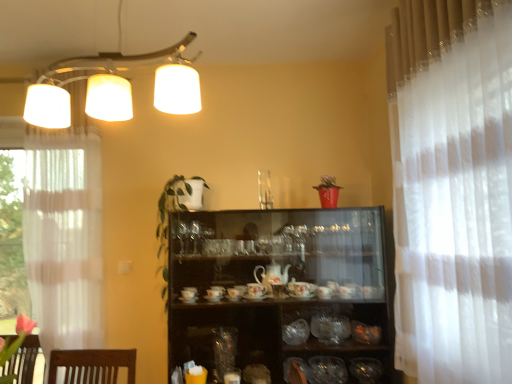
Question: Is the surface of green leafy plant at center in direct contact with transparent glass vase at center, the first tableware viewed from the left?

Choices:
 (A) yes
 (B) no

Answer: (B)

Question: Does green leafy plant at center have a lesser width compared to transparent glass vase at center, the fifth tableware in the right-to-left sequence?

Choices:
 (A) no
 (B) yes

Answer: (A)

Question: From the image's perspective, is green leafy plant at center located above transparent glass vase at center, the first tableware viewed from the left?

Choices:
 (A) yes
 (B) no

Answer: (A)

Question: Is green leafy plant at center further to camera compared to transparent glass vase at center, the fifth tableware in the right-to-left sequence?

Choices:
 (A) no
 (B) yes

Answer: (A)

Question: From a real-world perspective, does green leafy plant at center sit lower than transparent glass vase at center, the fifth tableware in the right-to-left sequence?

Choices:
 (A) no
 (B) yes

Answer: (A)

Question: Is green leafy plant at center wider than transparent glass vase at center, the fifth tableware in the right-to-left sequence?

Choices:
 (A) yes
 (B) no

Answer: (A)

Question: From a real-world perspective, is green leafy plant at center physically above translucent glass bowl at lower right, the 5th tableware from the left?

Choices:
 (A) yes
 (B) no

Answer: (A)

Question: Could you tell me if green leafy plant at center is facing translucent glass bowl at lower right, the 5th tableware from the left?

Choices:
 (A) no
 (B) yes

Answer: (A)

Question: Is green leafy plant at center thinner than translucent glass bowl at lower right, marked as the first tableware in a right-to-left arrangement?

Choices:
 (A) yes
 (B) no

Answer: (B)

Question: Considering the relative sizes of green leafy plant at center and translucent glass bowl at lower right, marked as the first tableware in a right-to-left arrangement, in the image provided, is green leafy plant at center shorter than translucent glass bowl at lower right, marked as the first tableware in a right-to-left arrangement,?

Choices:
 (A) no
 (B) yes

Answer: (A)

Question: Is translucent glass bowl at lower right, marked as the first tableware in a right-to-left arrangement, completely or partially inside green leafy plant at center?

Choices:
 (A) no
 (B) yes

Answer: (A)

Question: Is green leafy plant at center completely or partially outside of translucent glass bowl at lower right, marked as the first tableware in a right-to-left arrangement?

Choices:
 (A) yes
 (B) no

Answer: (A)

Question: Is shiny metallic bowl at lower right, which ranks as the fourth tableware in left-to-right order, at the right side of translucent glass bowls at center, which is the third tableware from left to right?

Choices:
 (A) no
 (B) yes

Answer: (B)